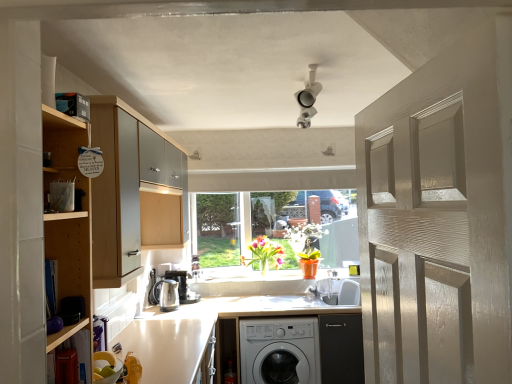
Question: Considering the relative positions of white matte washing machine at lower center and satin silver kettle at center, arranged as the 2th appliance when viewed from the front, in the image provided, is white matte washing machine at lower center to the right of satin silver kettle at center, arranged as the 2th appliance when viewed from the front, from the viewer's perspective?

Choices:
 (A) no
 (B) yes

Answer: (B)

Question: Can we say white matte washing machine at lower center lies outside satin silver kettle at center, arranged as the 2th appliance when viewed from the front?

Choices:
 (A) yes
 (B) no

Answer: (A)

Question: Considering the relative sizes of white matte washing machine at lower center and satin silver kettle at center, which ranks as the 1th appliance in back-to-front order, in the image provided, is white matte washing machine at lower center shorter than satin silver kettle at center, which ranks as the 1th appliance in back-to-front order,?

Choices:
 (A) no
 (B) yes

Answer: (A)

Question: From a real-world perspective, is white matte washing machine at lower center under satin silver kettle at center, which ranks as the 1th appliance in back-to-front order?

Choices:
 (A) yes
 (B) no

Answer: (A)

Question: Considering the relative positions of white matte washing machine at lower center and satin silver kettle at center, which ranks as the 1th appliance in back-to-front order, in the image provided, is white matte washing machine at lower center behind satin silver kettle at center, which ranks as the 1th appliance in back-to-front order,?

Choices:
 (A) yes
 (B) no

Answer: (B)

Question: Is satin silver kettle at center, arranged as the 2th appliance when viewed from the front, surrounded by white matte washing machine at lower center?

Choices:
 (A) yes
 (B) no

Answer: (B)

Question: Does white glossy countertop at lower center have a larger size compared to wooden cabinet at left, the 1th cabinetry when ordered from back to front?

Choices:
 (A) no
 (B) yes

Answer: (A)

Question: Is wooden cabinet at left, placed as the 2th cabinetry when sorted from front to back, located within white glossy countertop at lower center?

Choices:
 (A) yes
 (B) no

Answer: (B)

Question: Is white glossy countertop at lower center to the right of wooden cabinet at left, the 1th cabinetry when ordered from back to front, from the viewer's perspective?

Choices:
 (A) no
 (B) yes

Answer: (B)

Question: Is white glossy countertop at lower center positioned behind wooden cabinet at left, placed as the 2th cabinetry when sorted from front to back?

Choices:
 (A) no
 (B) yes

Answer: (B)

Question: Can you confirm if white glossy countertop at lower center is smaller than wooden cabinet at left, placed as the 2th cabinetry when sorted from front to back?

Choices:
 (A) yes
 (B) no

Answer: (A)

Question: Is white glossy countertop at lower center wider than wooden cabinet at left, placed as the 2th cabinetry when sorted from front to back?

Choices:
 (A) no
 (B) yes

Answer: (B)

Question: Is satin silver kettle at lower left, placed as the second appliance when sorted from back to front, thinner than white glossy countertop at lower center?

Choices:
 (A) no
 (B) yes

Answer: (B)